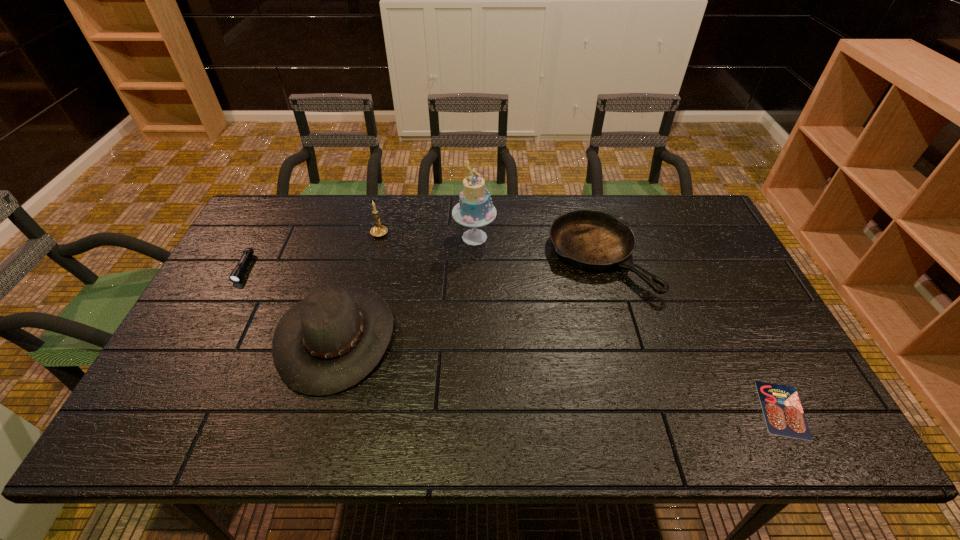
Image resolution: width=960 pixels, height=540 pixels. In order to click on vacant region that satisfies the following two spatial constraints: 1. with a ladder on the side of the frying pan; 2. on the left side of the fourth object from left to right in this screenshot , I will do `click(474, 258)`.

Locate an element on the screen. The height and width of the screenshot is (540, 960). free location that satisfies the following two spatial constraints: 1. on the front side of the second object from right to left; 2. on the front-facing side of the hat is located at coordinates (621, 336).

Where is `free spot that satisfies the following two spatial constraints: 1. on the back side of the rightmost object; 2. on the front-facing side of the hat`? Image resolution: width=960 pixels, height=540 pixels. free spot that satisfies the following two spatial constraints: 1. on the back side of the rightmost object; 2. on the front-facing side of the hat is located at coordinates (745, 336).

What are the coordinates of `vacant region that satisfies the following two spatial constraints: 1. at the lens end of the flashlight; 2. on the right side of the salami` in the screenshot? It's located at (170, 409).

Identify the location of free location that satisfies the following two spatial constraints: 1. with a ladder on the side of the third object from right to left; 2. at the lens end of the flashlight. The height and width of the screenshot is (540, 960). (474, 268).

Locate an element on the screen. The image size is (960, 540). free spot that satisfies the following two spatial constraints: 1. with a ladder on the side of the frying pan; 2. on the right side of the cake is located at coordinates (474, 258).